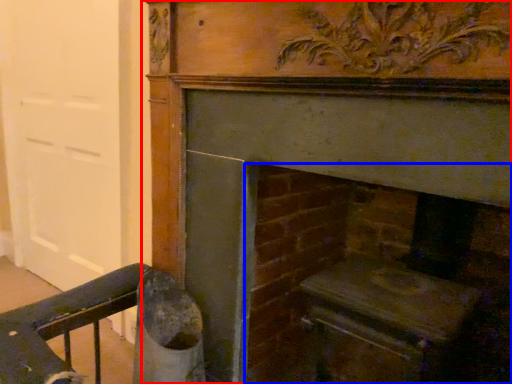
Question: Which object appears closest to the camera in this image, fireplace (highlighted by a red box) or fireplace (highlighted by a blue box)?

Choices:
 (A) fireplace
 (B) fireplace

Answer: (A)